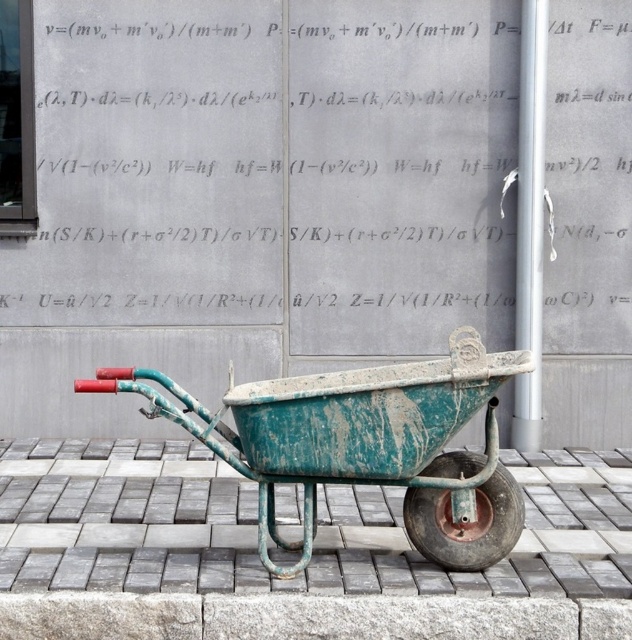
Question: Considering the real-world distances, which object is closest to the green weathered wheelbarrow at center?

Choices:
 (A) green weathered pavement at center
 (B) rusty metal wheel at lower center
 (C) gray stone curb at lower center

Answer: (B)

Question: Which object is positioned farthest from the green weathered pavement at center?

Choices:
 (A) gray stone curb at lower center
 (B) green weathered wheelbarrow at center

Answer: (A)

Question: Is green weathered wheelbarrow at center smaller than gray stone curb at lower center?

Choices:
 (A) yes
 (B) no

Answer: (B)

Question: Which object is the farthest from the rusty metal wheel at lower center?

Choices:
 (A) green weathered wheelbarrow at center
 (B) green weathered pavement at center
 (C) gray stone curb at lower center

Answer: (B)

Question: Is green weathered wheelbarrow at center smaller than gray stone curb at lower center?

Choices:
 (A) no
 (B) yes

Answer: (A)

Question: Does green weathered pavement at center appear on the left side of gray stone curb at lower center?

Choices:
 (A) no
 (B) yes

Answer: (A)